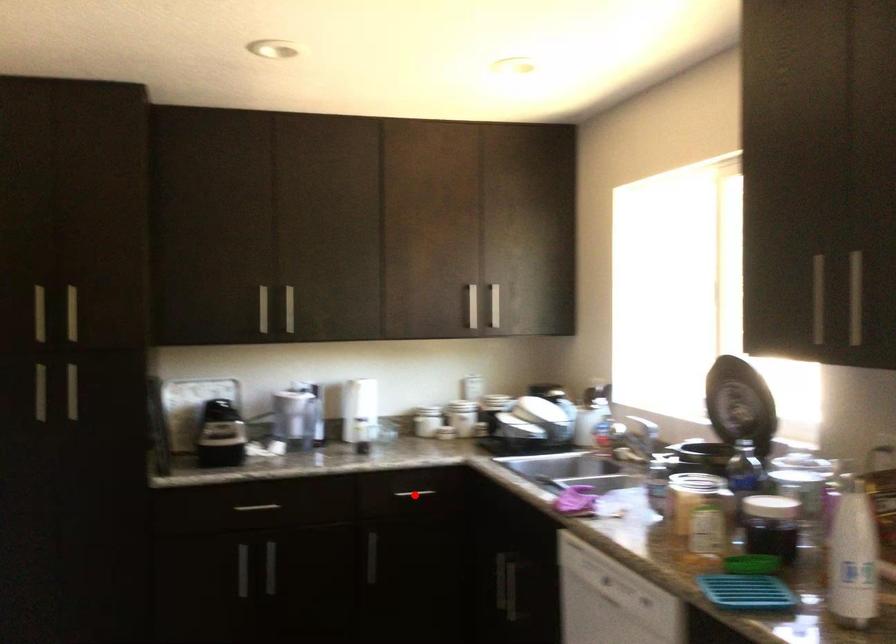
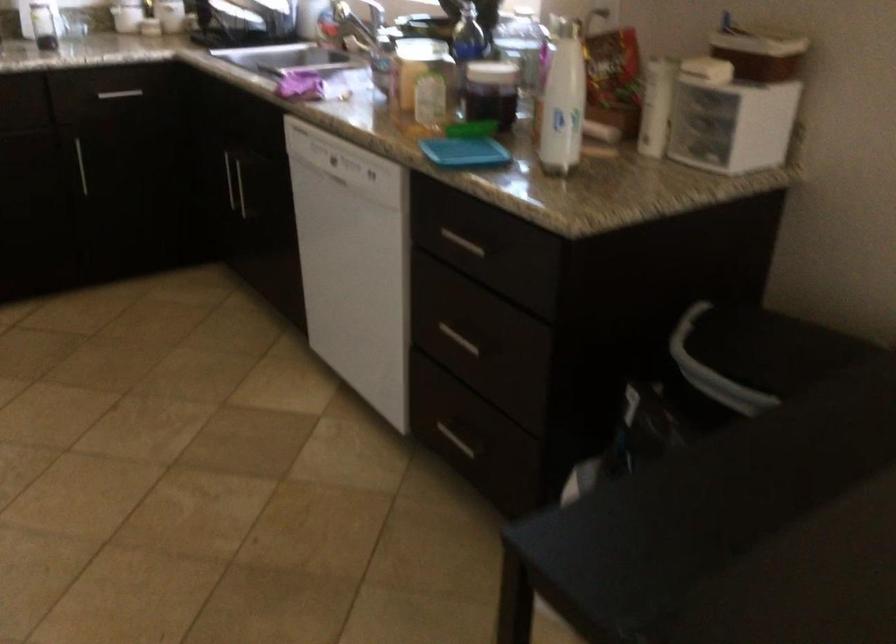
Question: I am providing you with two images of the same scene from different viewpoints. In image1, a red point is highlighted. Considering the same 3D point in image2, which of the following is correct?

Choices:
 (A) It is closer
 (B) It is farther

Answer: (A)